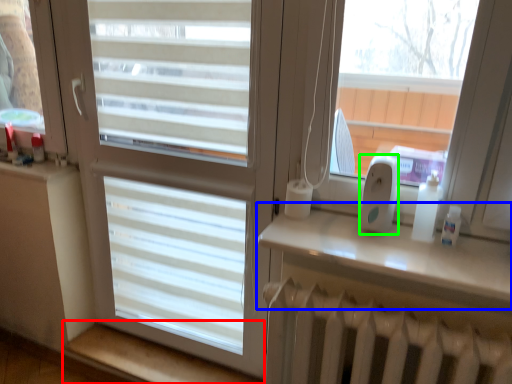
Question: Which object is the closest to the window sill (highlighted by a red box)? Choose among these: window sill (highlighted by a blue box) or ipod (highlighted by a green box).

Choices:
 (A) window sill
 (B) ipod

Answer: (A)